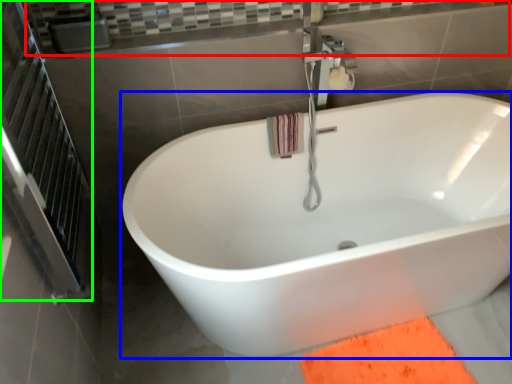
Question: Which object is positioned closest to balustrade (highlighted by a red box)? Select from bathtub (highlighted by a blue box) and screen door (highlighted by a green box).

Choices:
 (A) bathtub
 (B) screen door

Answer: (B)